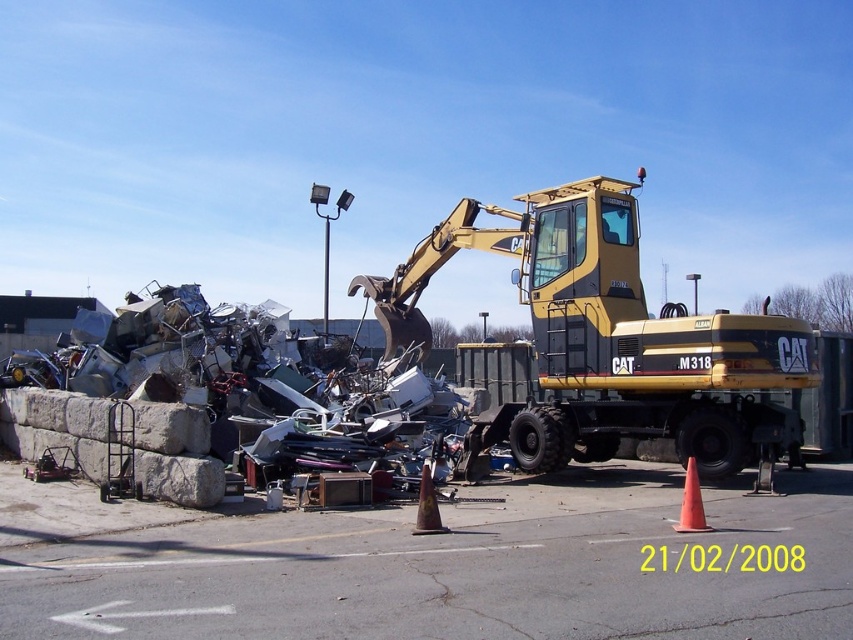
Question: Considering the relative positions of orange matte traffic cone at center-right and brown matte traffic cone at center in the image provided, where is orange matte traffic cone at center-right located with respect to brown matte traffic cone at center?

Choices:
 (A) right
 (B) left

Answer: (A)

Question: Among these points, which one is nearest to the camera?

Choices:
 (A) (767, 468)
 (B) (575, 452)

Answer: (A)

Question: Which of the following is the closest to the observer?

Choices:
 (A) orange matte traffic cone at center-right
 (B) yellow metallic excavator at center
 (C) orange matte traffic cone at lower right
 (D) brown matte traffic cone at center

Answer: (A)

Question: Which object appears closest to the camera in this image?

Choices:
 (A) brown matte traffic cone at center
 (B) orange matte traffic cone at center-right
 (C) yellow metallic excavator at center
 (D) orange matte traffic cone at lower right

Answer: (B)

Question: Does yellow metallic excavator at center have a smaller size compared to orange matte traffic cone at lower right?

Choices:
 (A) yes
 (B) no

Answer: (B)

Question: Is yellow metallic excavator at center bigger than brown matte traffic cone at center?

Choices:
 (A) yes
 (B) no

Answer: (A)